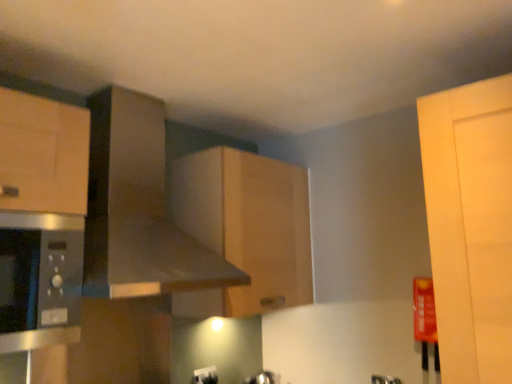
Question: Does wooden cabinet at center have a greater width compared to white plastic electric outlet at lower center?

Choices:
 (A) yes
 (B) no

Answer: (A)

Question: Is wooden cabinet at center at the left side of white plastic electric outlet at lower center?

Choices:
 (A) no
 (B) yes

Answer: (A)

Question: Is wooden cabinet at center in contact with white plastic electric outlet at lower center?

Choices:
 (A) yes
 (B) no

Answer: (B)

Question: From the image's perspective, would you say wooden cabinet at center is positioned over white plastic electric outlet at lower center?

Choices:
 (A) no
 (B) yes

Answer: (B)

Question: Is wooden cabinet at center not within white plastic electric outlet at lower center?

Choices:
 (A) no
 (B) yes

Answer: (B)

Question: From the image's perspective, is satin silver microwave at left positioned above or below white plastic electric outlet at lower center?

Choices:
 (A) below
 (B) above

Answer: (B)

Question: Would you say satin silver microwave at left is to the left or to the right of white plastic electric outlet at lower center in the picture?

Choices:
 (A) left
 (B) right

Answer: (A)

Question: Which is correct: satin silver microwave at left is inside white plastic electric outlet at lower center, or outside of it?

Choices:
 (A) inside
 (B) outside

Answer: (B)

Question: In terms of height, does satin silver microwave at left look taller or shorter compared to white plastic electric outlet at lower center?

Choices:
 (A) short
 (B) tall

Answer: (B)

Question: From a real-world perspective, is matte silver faucet at lower center physically located above or below wooden cabinet at center?

Choices:
 (A) above
 (B) below

Answer: (B)

Question: Based on their sizes in the image, would you say matte silver faucet at lower center is bigger or smaller than wooden cabinet at center?

Choices:
 (A) small
 (B) big

Answer: (A)

Question: Is matte silver faucet at lower center in front of or behind wooden cabinet at center in the image?

Choices:
 (A) behind
 (B) front

Answer: (A)

Question: Is matte silver faucet at lower center inside the boundaries of wooden cabinet at center, or outside?

Choices:
 (A) inside
 (B) outside

Answer: (B)

Question: In the image, is metallic gray exhaust hood at upper center on the left side or the right side of white plastic electric outlet at lower center?

Choices:
 (A) left
 (B) right

Answer: (A)

Question: Which is correct: metallic gray exhaust hood at upper center is inside white plastic electric outlet at lower center, or outside of it?

Choices:
 (A) outside
 (B) inside

Answer: (A)